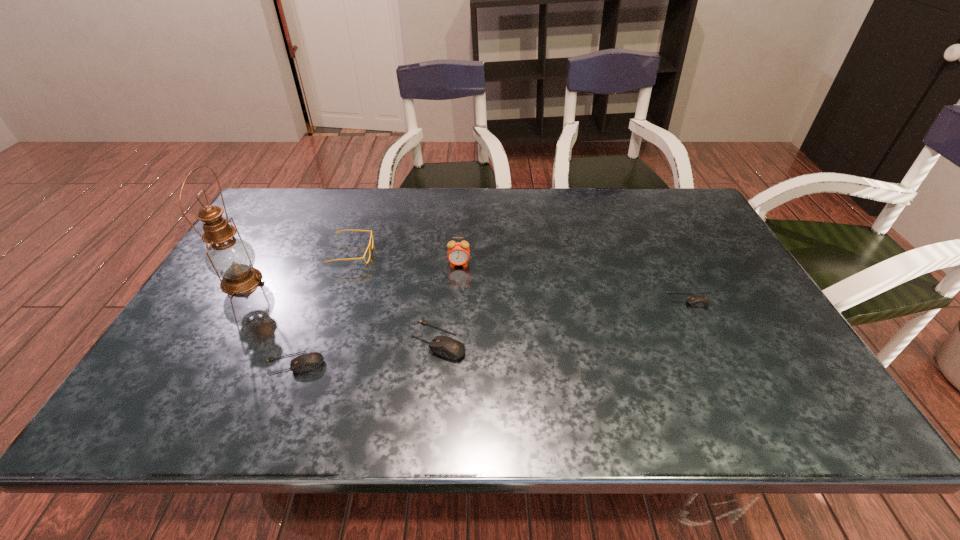
This screenshot has height=540, width=960. In order to click on free location that satisfies the following two spatial constraints: 1. on the face of the alarm clock; 2. on the left side of the farthest mouse in this screenshot , I will do `click(457, 300)`.

Image resolution: width=960 pixels, height=540 pixels. What are the coordinates of `free space that satisfies the following two spatial constraints: 1. on the back side of the rightmost mouse; 2. on the left side of the fifth tallest object` in the screenshot? It's located at (319, 300).

The image size is (960, 540). In order to click on blank space that satisfies the following two spatial constraints: 1. in front of the lenses of the shortest mouse; 2. on the right side of the spectacles in this screenshot , I will do `click(336, 300)`.